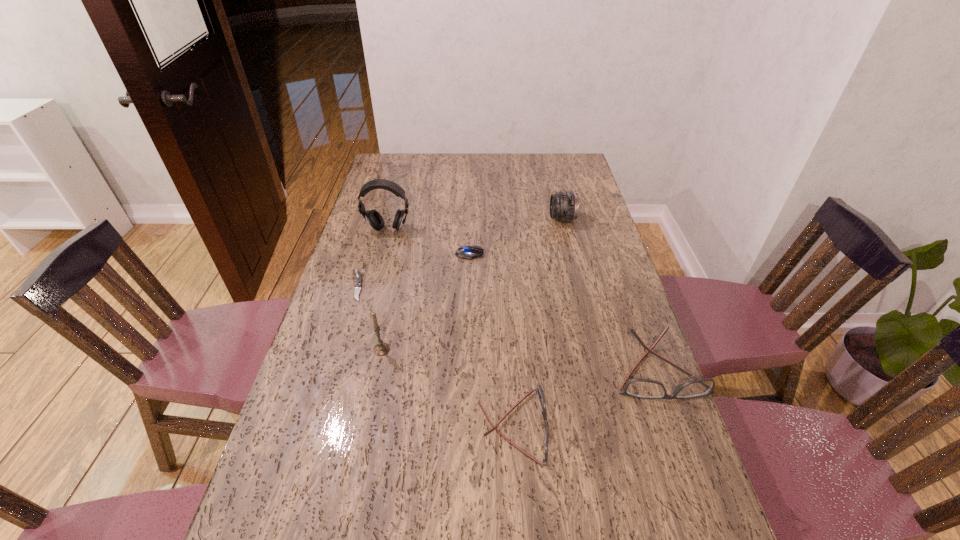
Where is `earphone present at the left edge`? earphone present at the left edge is located at coordinates (373, 217).

I want to click on candle at the left edge, so click(380, 349).

The image size is (960, 540). What are the coordinates of `pocketknife that is at the left edge` in the screenshot? It's located at (358, 278).

This screenshot has height=540, width=960. I want to click on spectacles that is at the right edge, so click(639, 388).

You are a GUI agent. You are given a task and a screenshot of the screen. Output one action in this format:
    pyautogui.click(x=<x>, y=<y>)
    Task: Click on the telephoto lens situated at the right edge
    This screenshot has height=540, width=960.
    Given the screenshot: What is the action you would take?
    pyautogui.click(x=564, y=207)

The height and width of the screenshot is (540, 960). Find the location of `vacant space at the far edge of the desktop`. vacant space at the far edge of the desktop is located at coordinates (481, 173).

Find the location of a particular element. The width and height of the screenshot is (960, 540). vacant space at the near edge of the desktop is located at coordinates (434, 515).

Locate an element on the screen. free location at the left edge of the desktop is located at coordinates (337, 361).

What are the coordinates of `free point at the right edge` in the screenshot? It's located at point(580,200).

Find the location of a particular element. This screenshot has height=540, width=960. free spot at the far left corner of the desktop is located at coordinates (392, 170).